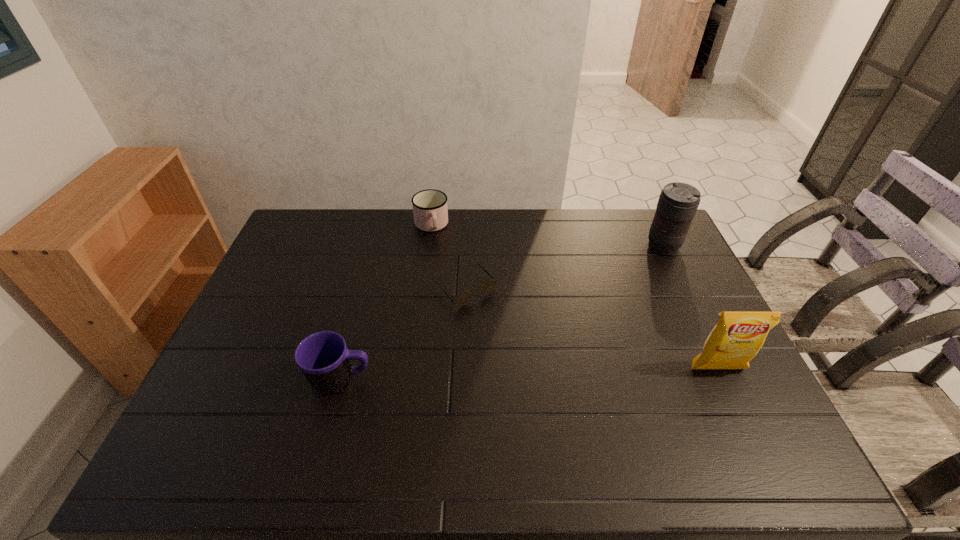
Identify the location of free region located on the front-facing side of the third nearest object. This screenshot has height=540, width=960. (564, 396).

This screenshot has height=540, width=960. I want to click on vacant region located 0.180m on the front-facing side of the third nearest object, so click(518, 346).

At what (x,y) coordinates should I click in order to perform the action: click on vacant space situated 0.080m on the front-facing side of the third nearest object. Please return your answer as a coordinate pair (x, y). Looking at the image, I should click on (498, 323).

Image resolution: width=960 pixels, height=540 pixels. Identify the location of free space located 0.270m on the side of the telephoto lens where the control switches are located. (612, 294).

This screenshot has width=960, height=540. I want to click on vacant position located on the side of the telephoto lens where the control switches are located, so click(x=647, y=261).

You are a GUI agent. You are given a task and a screenshot of the screen. Output one action in this format:
    pyautogui.click(x=<x>, y=<y>)
    Task: Click on the free space located on the side of the telephoto lens where the control switches are located
    This screenshot has width=960, height=540.
    Given the screenshot: What is the action you would take?
    pos(640,267)

Locate an element on the screen. The height and width of the screenshot is (540, 960). vacant space situated on the side of the farther mug with the handle is located at coordinates (438, 253).

You are a GUI agent. You are given a task and a screenshot of the screen. Output one action in this format:
    pyautogui.click(x=<x>, y=<y>)
    Task: Click on the vacant space located 0.370m on the side of the farther mug with the handle
    This screenshot has width=960, height=540.
    Given the screenshot: What is the action you would take?
    pyautogui.click(x=456, y=313)

The height and width of the screenshot is (540, 960). I want to click on free space located on the side of the farther mug with the handle, so click(449, 291).

At what (x,y) coordinates should I click in order to perform the action: click on telephoto lens situated at the far edge. Please return your answer as a coordinate pair (x, y). Looking at the image, I should click on (678, 202).